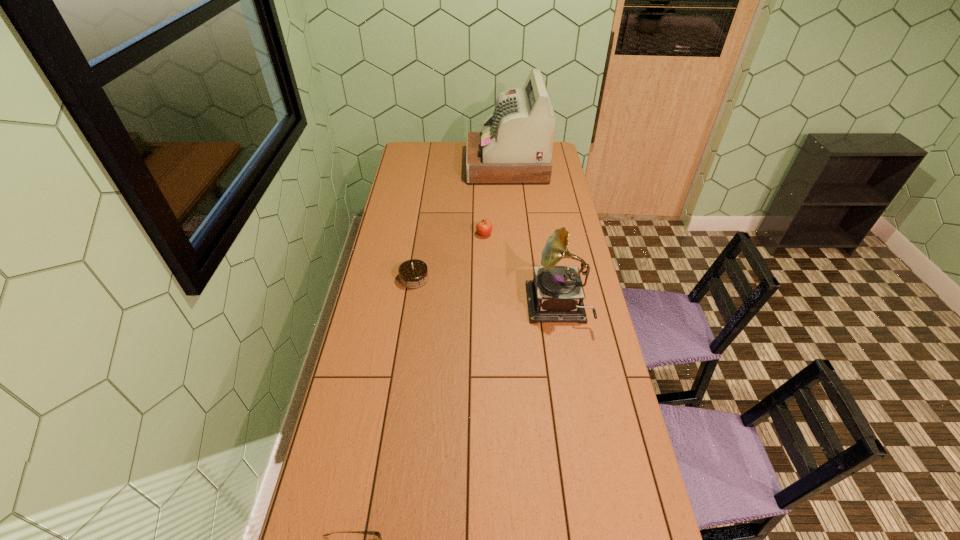
The image size is (960, 540). I want to click on the tallest object, so click(515, 147).

At what (x,y) coordinates should I click in order to perform the action: click on the farthest object. Please return your answer as a coordinate pair (x, y). Image resolution: width=960 pixels, height=540 pixels. Looking at the image, I should click on coord(515,147).

The image size is (960, 540). I want to click on the fourth shortest object, so (556, 293).

Locate an element on the screen. The image size is (960, 540). apple is located at coordinates (x=484, y=227).

You are a GUI agent. You are given a task and a screenshot of the screen. Output one action in this format:
    pyautogui.click(x=<x>, y=<y>)
    Task: Click on the chocolate cake
    The image size is (960, 540).
    Given the screenshot: What is the action you would take?
    pyautogui.click(x=413, y=274)

Where is `vacant space located 0.270m on the operating side of the tallest object`? The image size is (960, 540). vacant space located 0.270m on the operating side of the tallest object is located at coordinates (419, 167).

Find the location of a particular element. The width and height of the screenshot is (960, 540). free space located 0.110m on the operating side of the tallest object is located at coordinates (447, 167).

Locate an element on the screen. Image resolution: width=960 pixels, height=540 pixels. vacant area situated 0.080m on the operating side of the tallest object is located at coordinates (452, 167).

The height and width of the screenshot is (540, 960). In order to click on free spot located 0.380m on the horn of the second tallest object in this screenshot , I will do `click(430, 308)`.

Identify the location of vacant space situated 0.160m on the horn of the second tallest object. (487, 308).